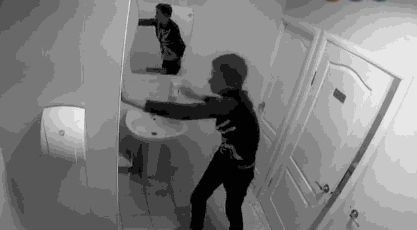
The width and height of the screenshot is (417, 230). Find the location of `towel rack`. towel rack is located at coordinates pyautogui.click(x=351, y=216).